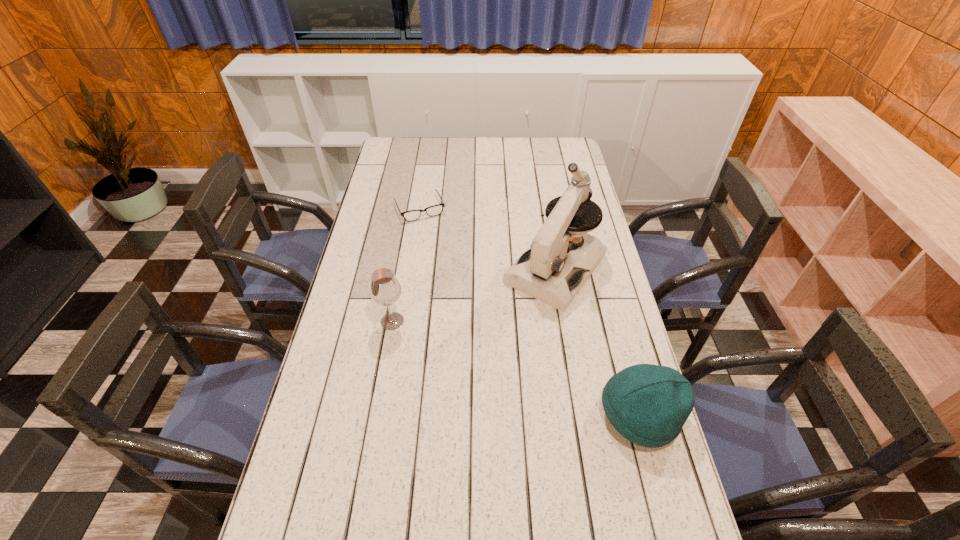
This screenshot has height=540, width=960. Identify the location of free space on the desktop that is between the second tallest object and the nearest object and is positioned at the eyepiece of the microscope. (485, 356).

The image size is (960, 540). I want to click on free space on the desktop that is between the second tallest object and the second shortest object and is positioned on the front-facing side of the spectacles, so click(488, 357).